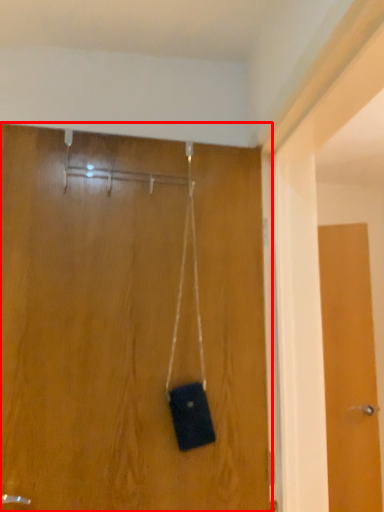
Question: From the image's perspective, where is door (annotated by the red box) located relative to door?

Choices:
 (A) below
 (B) above

Answer: (B)